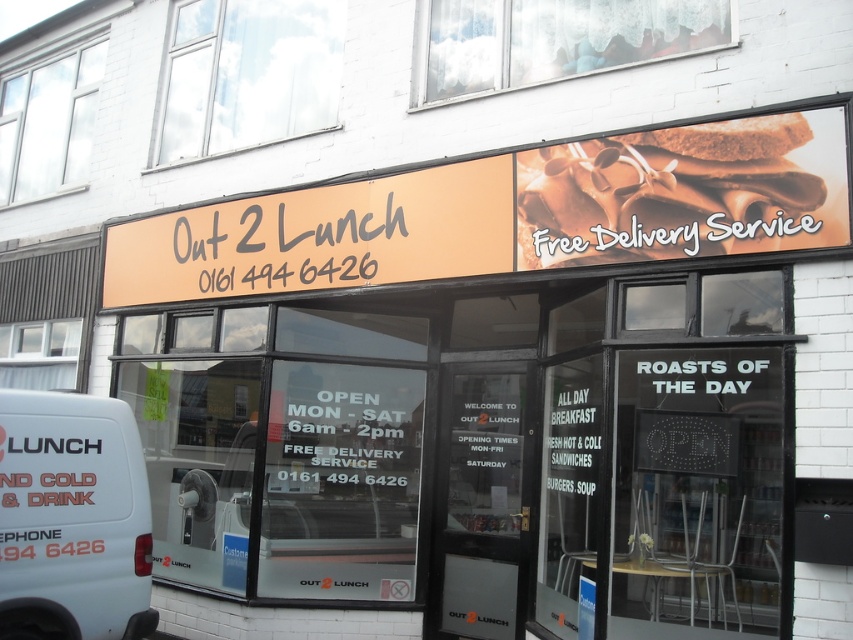
Question: Does chocolate matte sandwich at upper right come in front of white matte van at lower left?

Choices:
 (A) yes
 (B) no

Answer: (B)

Question: Does chocolate matte sandwich at upper right have a greater width compared to white matte van at lower left?

Choices:
 (A) yes
 (B) no

Answer: (A)

Question: Among these points, which one is nearest to the camera?

Choices:
 (A) (32, 632)
 (B) (804, 177)

Answer: (A)

Question: Which object is farther from the camera taking this photo?

Choices:
 (A) chocolate matte sandwich at upper right
 (B) white matte van at lower left

Answer: (A)

Question: Among these objects, which one is farthest from the camera?

Choices:
 (A) white matte van at lower left
 (B) chocolate matte sandwich at upper right

Answer: (B)

Question: Does chocolate matte sandwich at upper right have a greater width compared to white matte van at lower left?

Choices:
 (A) yes
 (B) no

Answer: (A)